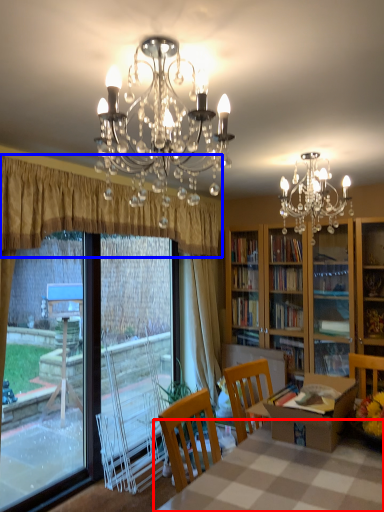
Question: Which object is further to the camera taking this photo, table (highlighted by a red box) or curtain (highlighted by a blue box)?

Choices:
 (A) table
 (B) curtain

Answer: (B)